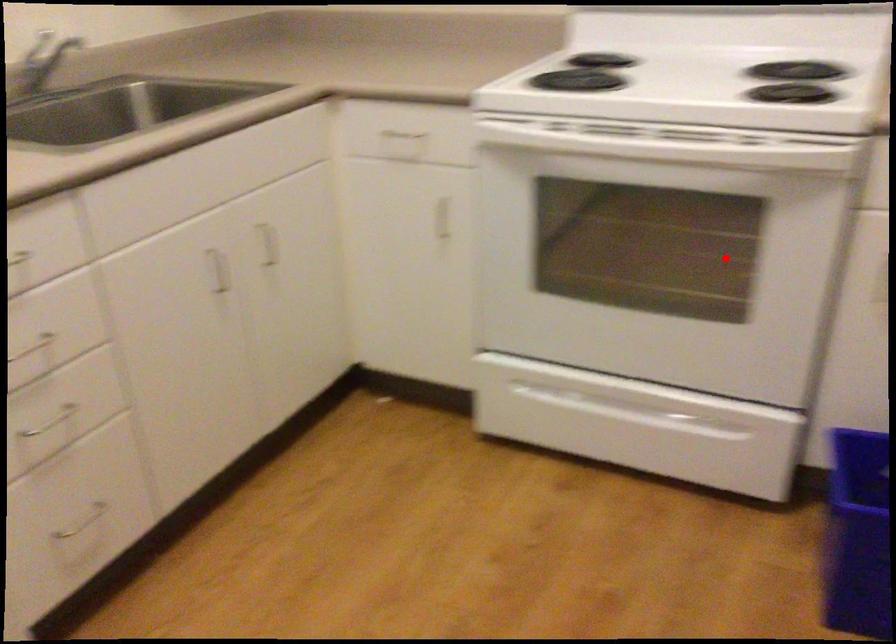
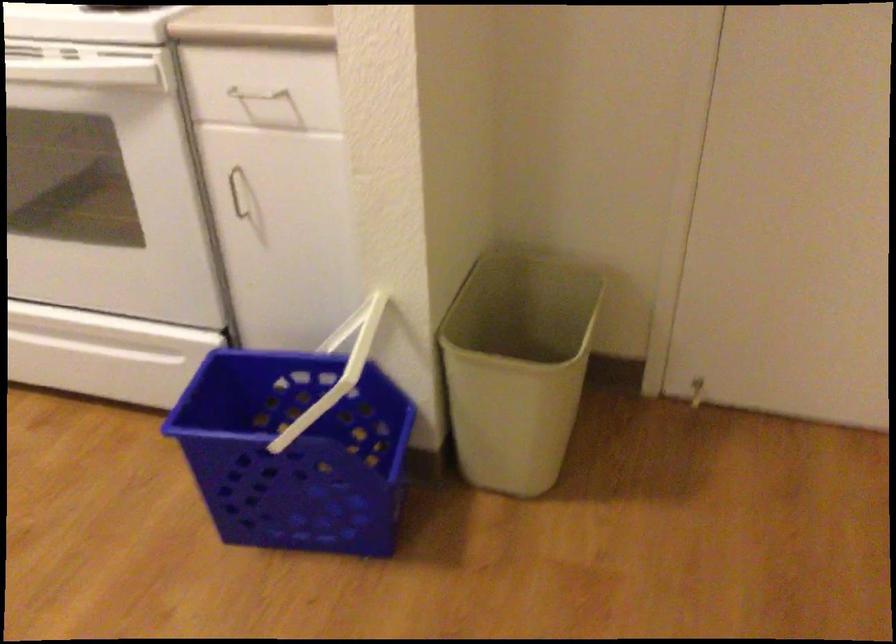
Find the pixel in the second image that matches the highlighted location in the first image.

(104, 185)